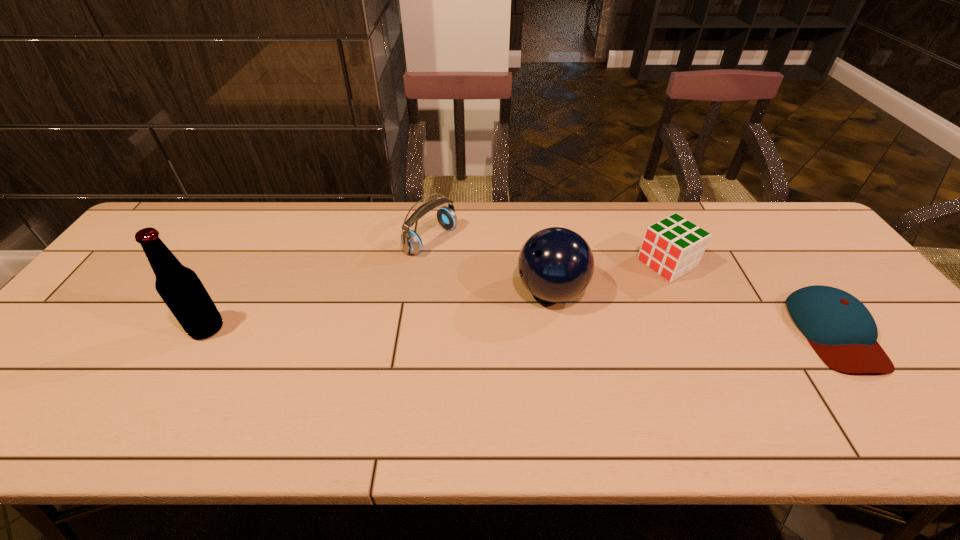
At what (x,y) coordinates should I click in order to perform the action: click on free space between the third shortest object and the beer bottle. Please return your answer as a coordinate pair (x, y). Looking at the image, I should click on (319, 284).

Where is `vacant space that is in between the fourth shortest object and the third shortest object`? vacant space that is in between the fourth shortest object and the third shortest object is located at coordinates (492, 265).

Locate an element on the screen. Image resolution: width=960 pixels, height=540 pixels. blank region between the fourth object from left to right and the rightmost object is located at coordinates (751, 298).

Where is `free area in between the third object from left to right and the third shortest object`? The image size is (960, 540). free area in between the third object from left to right and the third shortest object is located at coordinates click(x=492, y=265).

I want to click on unoccupied position between the third object from left to right and the cube, so (x=610, y=277).

Where is `object that is the closest one to the rightmost object`? object that is the closest one to the rightmost object is located at coordinates (673, 246).

Locate an element on the screen. This screenshot has height=540, width=960. object that is the closest to the cube is located at coordinates (556, 264).